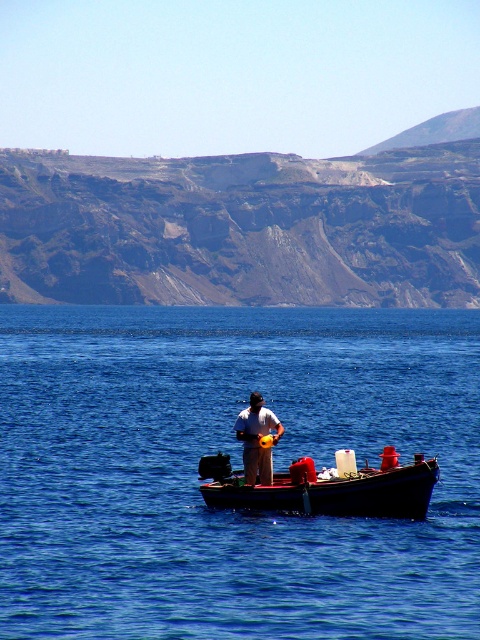
Is blue water at center below matte yellow helmet at center?

Actually, blue water at center is above matte yellow helmet at center.

Does blue water at center come behind matte yellow helmet at center?

No, blue water at center is in front of matte yellow helmet at center.

Is point (137, 604) positioned in front of point (268, 449)?

Yes, it is in front of point (268, 449).

Locate an element on the screen. blue water at center is located at coordinates (235, 467).

Who is positioned more to the left, wooden boat at center or matte yellow helmet at center?

matte yellow helmet at center

Is wooden boat at center wider than matte yellow helmet at center?

Indeed, wooden boat at center has a greater width compared to matte yellow helmet at center.

Does point (315, 493) come in front of point (238, 426)?

Yes, point (315, 493) is closer to viewer.

Where is `wooden boat at center`? wooden boat at center is located at coordinates (325, 488).

Does blue water at center have a lesser height compared to wooden boat at center?

Incorrect, blue water at center's height does not fall short of wooden boat at center's.

Describe the element at coordinates (235, 467) in the screenshot. I see `blue water at center` at that location.

Locate an element on the screen. The height and width of the screenshot is (640, 480). blue water at center is located at coordinates [x=235, y=467].